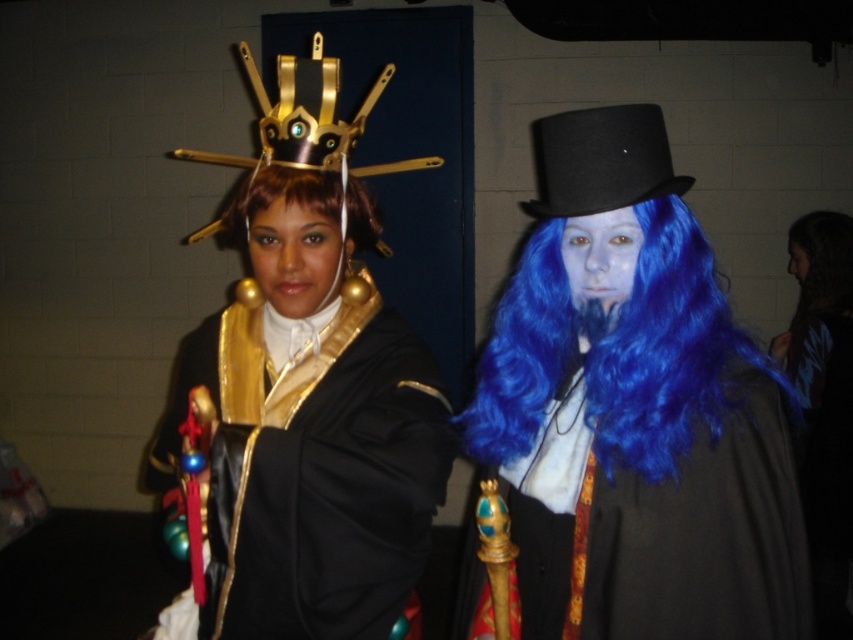
You are a photographer at a cosplay event and need to position the two cosplayers so that their accessories don not block each other. The blue synthetic wig at right and the blue velvet cape at right are both on the right cosplayer. Which accessory should be moved closer to the camera to prevent overlap?

The blue synthetic wig at right is larger in size than the blue velvet cape at right, so moving the larger blue synthetic wig at right closer to the camera would help prevent overlap between the two accessories.

You are standing in front of the two costumed individuals. There is a point at coordinates point (612,202) that is 1.06 meters away from you. If you want to place a small decoration exactly at that point, which direction should you move to reach it?

The point (612,202) is 1.06 meters away from you, so you should move forward 1.06 meters to reach it.

You are at a costume party and need to locate the blue synthetic wig at right. According to the coordinates provided, where exactly would you find it in the image?

The blue synthetic wig at right is located at point (x=614, y=352) in the image.